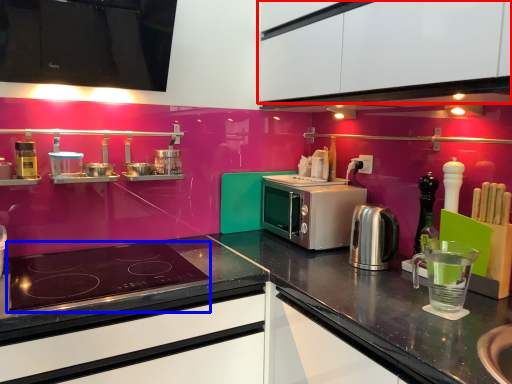
Question: Which of the following is the farthest to the observer, cabinetry (highlighted by a red box) or gas stove (highlighted by a blue box)?

Choices:
 (A) cabinetry
 (B) gas stove

Answer: (B)